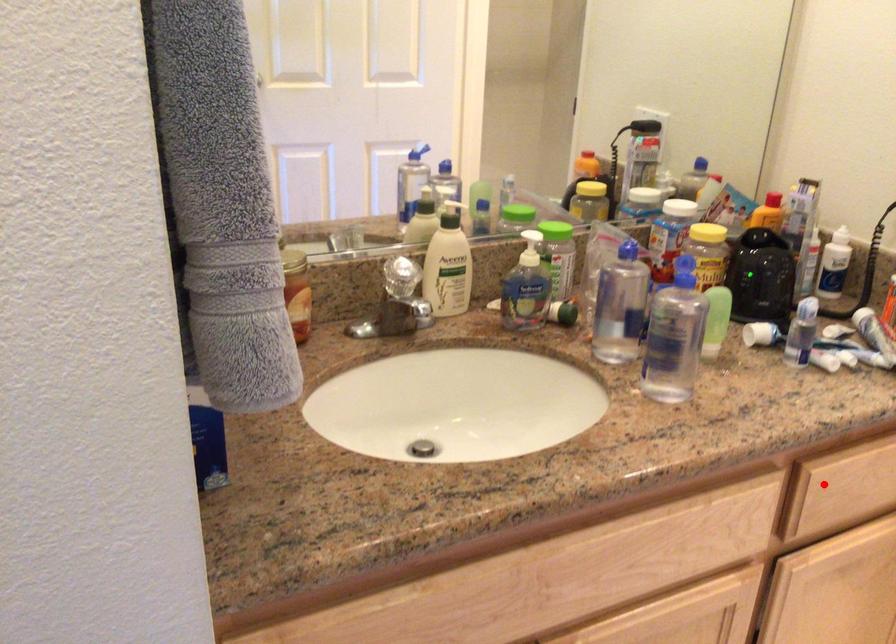
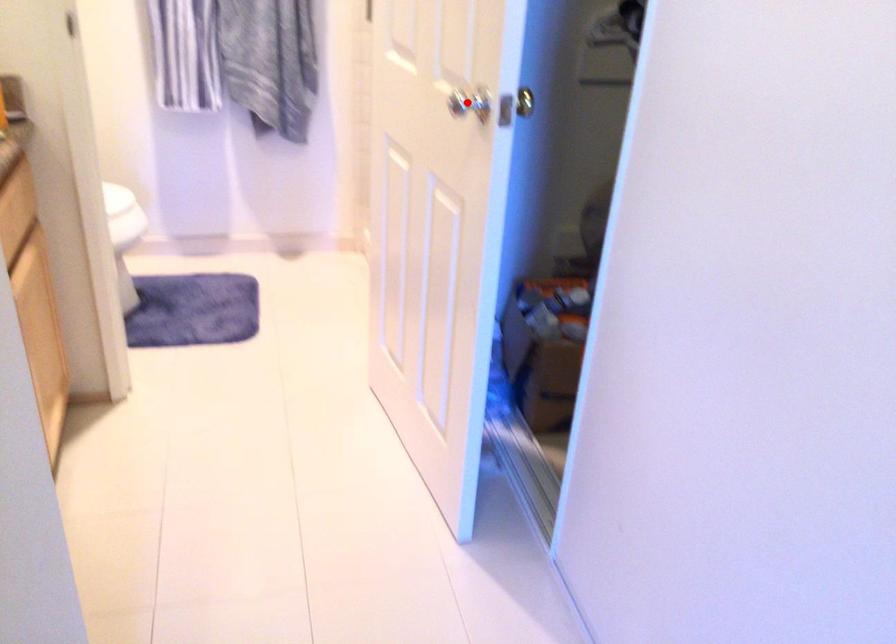
I am providing you with two images of the same scene from different viewpoints. A red point is marked on the first image and another point is marked on the second image. Does the point marked in image1 correspond to the same location as the one in image2?

No